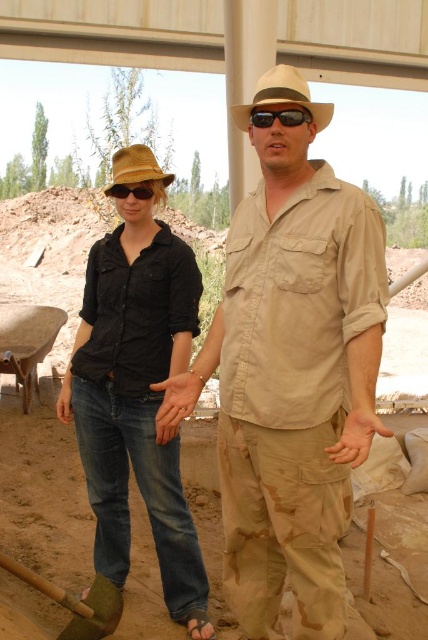
Between tan/camouflage pants at center and wooden shovel at lower left, which one appears on the left side from the viewer's perspective?

wooden shovel at lower left

Where is `tan/camouflage pants at center`? Image resolution: width=428 pixels, height=640 pixels. tan/camouflage pants at center is located at coordinates (291, 371).

The height and width of the screenshot is (640, 428). Find the location of `tan/camouflage pants at center`. tan/camouflage pants at center is located at coordinates (291, 371).

Is point (234, 106) in front of point (115, 186)?

Yes, it is.

Does beige straw cowboy hat at center appear on the left side of black matte sunglasses at center?

No, beige straw cowboy hat at center is not to the left of black matte sunglasses at center.

At what (x,y) coordinates should I click in order to perform the action: click on beige straw cowboy hat at center. Please return your answer as a coordinate pair (x, y). The width and height of the screenshot is (428, 640). Looking at the image, I should click on (282, 97).

The image size is (428, 640). Find the location of `beige straw cowboy hat at center`. beige straw cowboy hat at center is located at coordinates (282, 97).

Does tan/camouflage pants at center have a larger size compared to matte black shirt at center?

Correct, tan/camouflage pants at center is larger in size than matte black shirt at center.

Locate an element on the screen. The height and width of the screenshot is (640, 428). tan/camouflage pants at center is located at coordinates (291, 371).